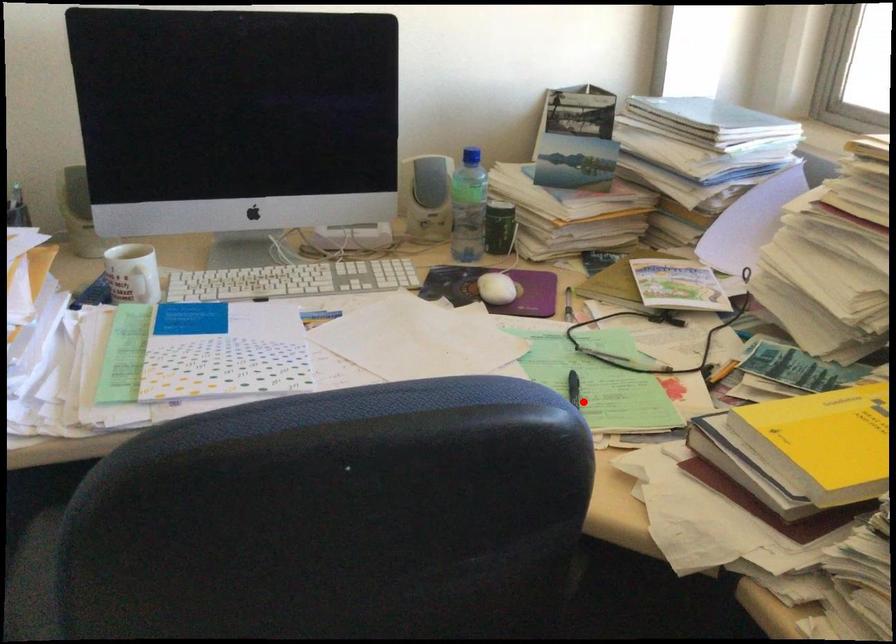
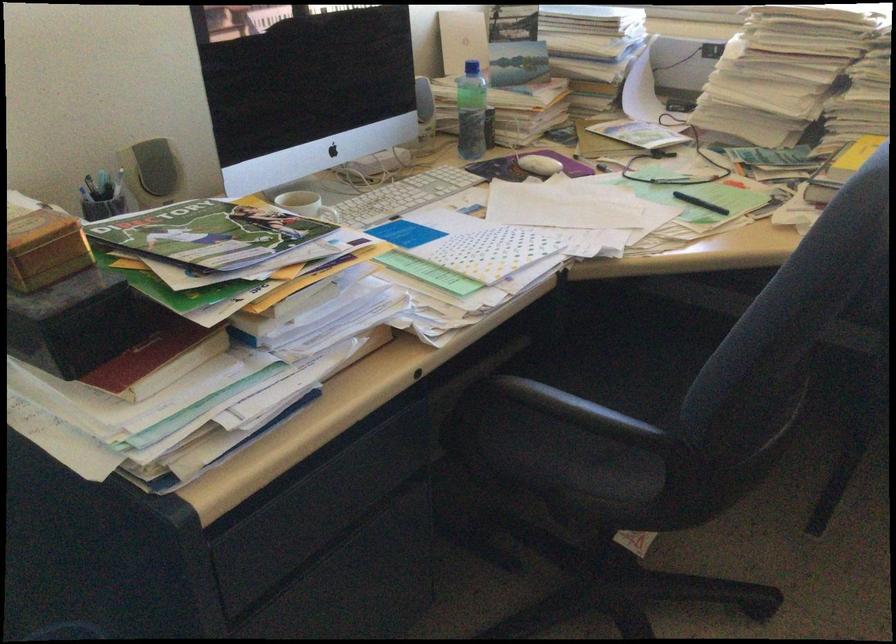
Question: A red point is marked in image1. In image2, is the corresponding 3D point closer to the camera or farther? Reply with the corresponding letter.

Choices:
 (A) The corresponding 3D point is closer.
 (B) The corresponding 3D point is farther.

Answer: (B)